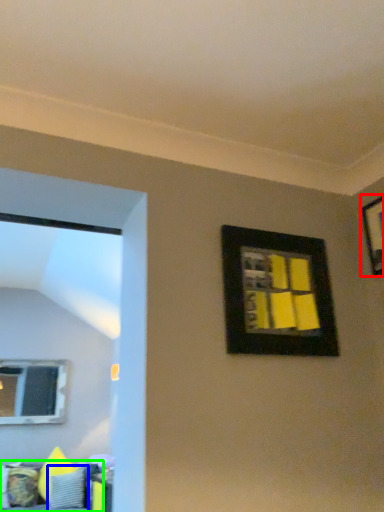
Question: Which object is the farthest from picture frame (highlighted by a red box)? Choose among these: pillow (highlighted by a blue box) or furniture (highlighted by a green box).

Choices:
 (A) pillow
 (B) furniture

Answer: (A)